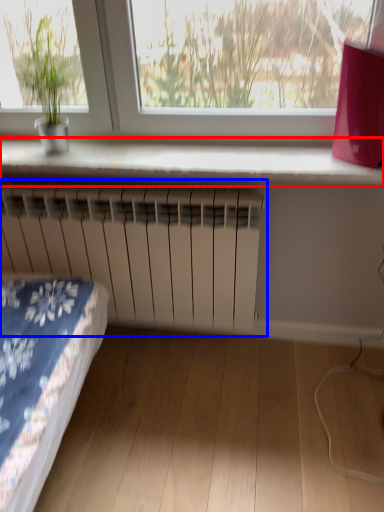
Question: Which point is closer to the camera, window sill (highlighted by a red box) or radiator (highlighted by a blue box)?

Choices:
 (A) window sill
 (B) radiator

Answer: (A)